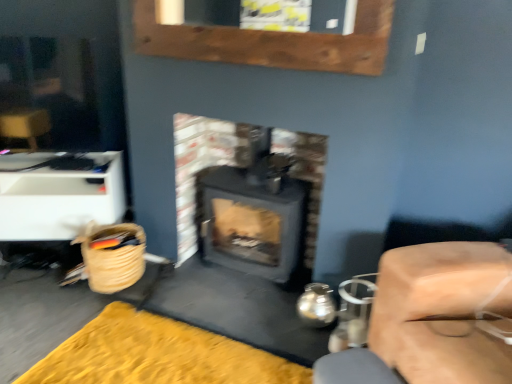
Where is `vacant area in front of woven straw basket at lower left`? vacant area in front of woven straw basket at lower left is located at coordinates (72, 317).